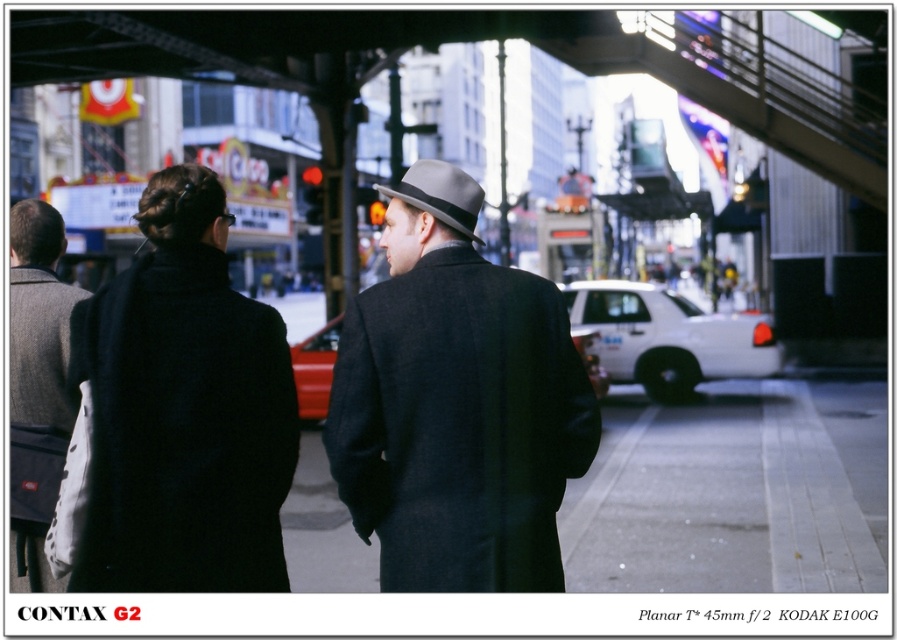
Which is above, matte gray coat at center or black wool coat at left?

Positioned higher is matte gray coat at center.

Is the position of matte gray coat at center more distant than that of black wool coat at left?

Yes, it is.

Image resolution: width=897 pixels, height=640 pixels. In order to click on matte gray coat at center in this screenshot , I will do `click(456, 403)`.

What are the coordinates of `matte gray coat at center` in the screenshot? It's located at (456, 403).

Who is more forward, [517,314] or [29,406]?

Point [517,314] is in front.

Is point (517, 360) closer to viewer compared to point (9, 333)?

Yes, it is.

You are a GUI agent. You are given a task and a screenshot of the screen. Output one action in this format:
    pyautogui.click(x=<x>, y=<y>)
    Task: Click on the matte gray coat at center
    This screenshot has width=897, height=640.
    Given the screenshot: What is the action you would take?
    pyautogui.click(x=456, y=403)

Who is positioned more to the left, black wool coat at left or gray wool coat at left?

gray wool coat at left is more to the left.

Who is more forward, (90,548) or (14,490)?

Point (90,548)

Is point (250, 520) in front of point (59, 280)?

Yes, it is.

The height and width of the screenshot is (640, 897). What are the coordinates of `black wool coat at left` in the screenshot? It's located at (184, 429).